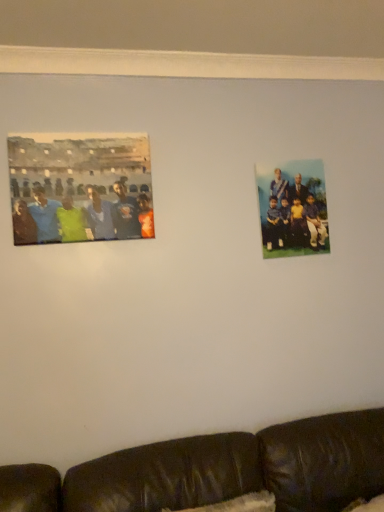
Question: Can you confirm if matte green shirt at left, the first person in the front-to-back sequence, is thinner than blue fabric group at upper right, the second person when ordered from left to right?

Choices:
 (A) yes
 (B) no

Answer: (B)

Question: Can you confirm if matte green shirt at left, the first person in the front-to-back sequence, is taller than blue fabric group at upper right, which is the second person in front-to-back order?

Choices:
 (A) yes
 (B) no

Answer: (B)

Question: Does matte green shirt at left, placed as the 1th person when sorted from left to right, have a larger size compared to blue fabric group at upper right, the second person when ordered from left to right?

Choices:
 (A) no
 (B) yes

Answer: (B)

Question: From a real-world perspective, is matte green shirt at left, the first person in the front-to-back sequence, below blue fabric group at upper right, which is the second person in front-to-back order?

Choices:
 (A) no
 (B) yes

Answer: (A)

Question: Considering the relative positions of matte green shirt at left, which is the second person from back to front, and blue fabric group at upper right, which is the 1th person in back-to-front order, in the image provided, is matte green shirt at left, which is the second person from back to front, to the left of blue fabric group at upper right, which is the 1th person in back-to-front order, from the viewer's perspective?

Choices:
 (A) no
 (B) yes

Answer: (B)

Question: Is matte green shirt at left, which is the 2th person from right to left, not inside blue fabric group at upper right, which is the second person in front-to-back order?

Choices:
 (A) yes
 (B) no

Answer: (A)

Question: Does blue fabric group at upper right, which is counted as the 1th person, starting from the right, appear on the right side of black leather couch at lower center?

Choices:
 (A) no
 (B) yes

Answer: (B)

Question: From a real-world perspective, does blue fabric group at upper right, which is the second person in front-to-back order, sit lower than black leather couch at lower center?

Choices:
 (A) yes
 (B) no

Answer: (B)

Question: Is blue fabric group at upper right, which is counted as the 1th person, starting from the right, turned away from black leather couch at lower center?

Choices:
 (A) no
 (B) yes

Answer: (A)

Question: Considering the relative sizes of blue fabric group at upper right, which is the 1th person in back-to-front order, and black leather couch at lower center in the image provided, is blue fabric group at upper right, which is the 1th person in back-to-front order, bigger than black leather couch at lower center?

Choices:
 (A) no
 (B) yes

Answer: (A)

Question: From the image's perspective, is blue fabric group at upper right, which is the second person in front-to-back order, beneath black leather couch at lower center?

Choices:
 (A) no
 (B) yes

Answer: (A)

Question: From a real-world perspective, does blue fabric group at upper right, which is the 1th person in back-to-front order, stand above black leather couch at lower center?

Choices:
 (A) no
 (B) yes

Answer: (B)

Question: Considering the relative sizes of matte green shirt at left, which is the 2th person from right to left, and black leather couch at lower center in the image provided, is matte green shirt at left, which is the 2th person from right to left, shorter than black leather couch at lower center?

Choices:
 (A) no
 (B) yes

Answer: (B)